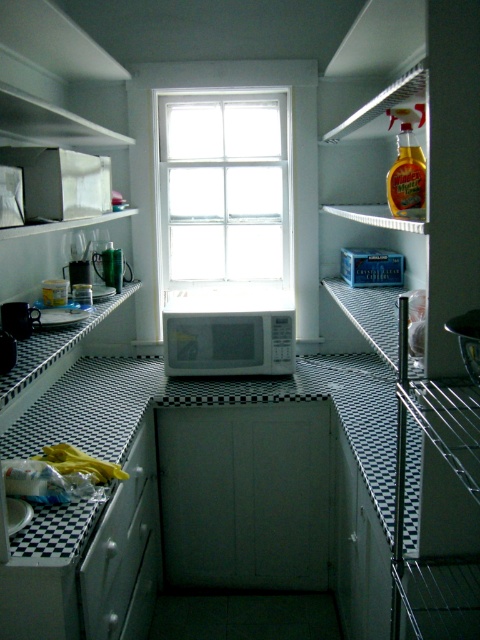
Question: Which point is farther from the camera taking this photo?

Choices:
 (A) (336, 300)
 (B) (101, 564)

Answer: (A)

Question: Where is metallic silver fridge at right located in relation to white glossy drawer at lower left in the image?

Choices:
 (A) below
 (B) above

Answer: (B)

Question: Can you confirm if white glass window at center is thinner than white glossy drawer at lower left?

Choices:
 (A) no
 (B) yes

Answer: (A)

Question: Which object appears farthest from the camera in this image?

Choices:
 (A) white matte microwave at center
 (B) metallic silver fridge at right
 (C) white glass window at center

Answer: (C)

Question: Does white glossy drawer at lower left come in front of white matte microwave at center?

Choices:
 (A) no
 (B) yes

Answer: (B)

Question: Among these objects, which one is farthest from the camera?

Choices:
 (A) white glossy drawer at lower left
 (B) white matte exhaust hood at upper center

Answer: (B)